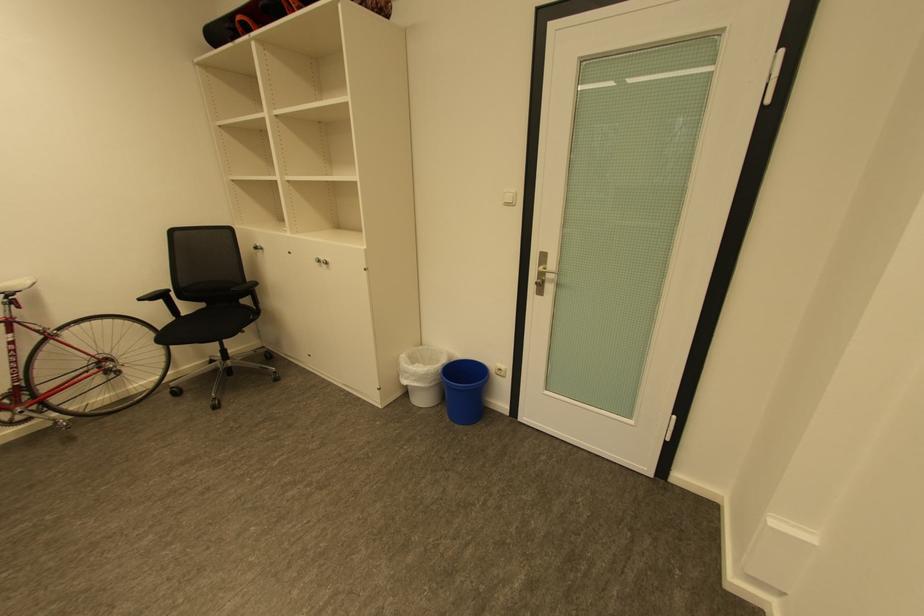
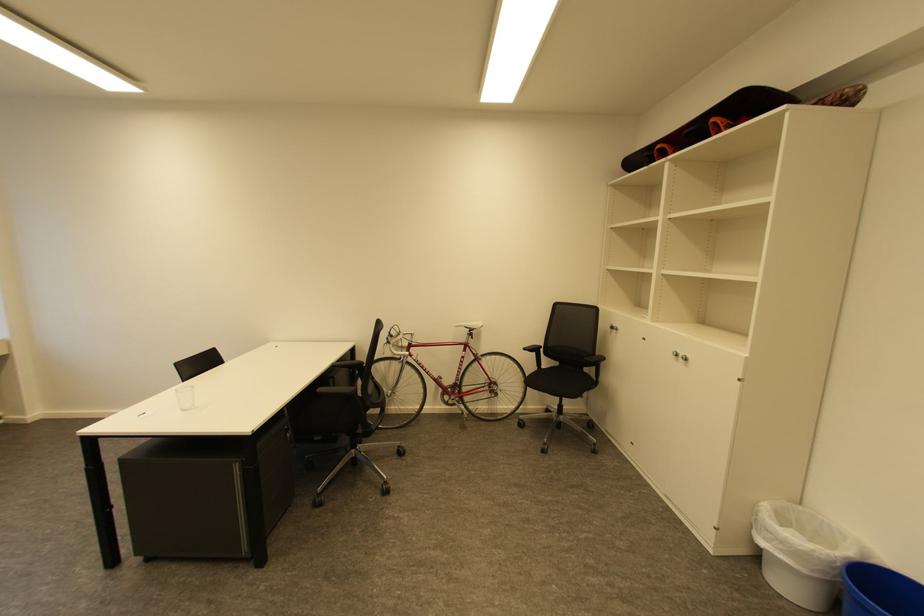
Question: The first image is from the beginning of the video and the second image is from the end. How did the camera likely rotate when shooting the video?

Choices:
 (A) Left
 (B) Right
 (C) Up
 (D) Down

Answer: (A)